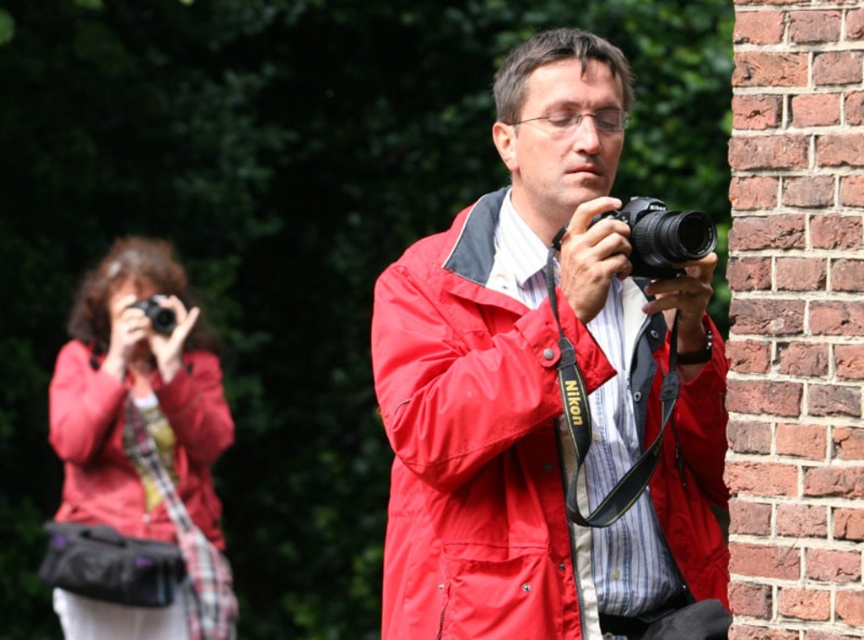
You are a photographer trying to position yourself between the two individuals in the scene. The first person is wearing a bright red jacket and holding a Nikon camera, while the second person is also in a red jacket and partially hidden by foliage. Which direction should you move to stand exactly halfway between the matte nylon jacket at center and the brick wall?

The matte nylon jacket at center is located at point (474,448). To stand halfway between it and the brick wall, you should move towards the coordinates that average their positions. Since the brick wall is next to the jacket, moving towards the wall from the jacket would place you midway.

You are a photographer trying to decide which item to carry in your backpack. You have both the matte nylon jacket at center and the matte black camera at center. Based on their sizes, which one can you fit more easily into a small compartment?

The matte nylon jacket at center is smaller than the matte black camera at center, so it can be fit more easily into a small compartment.